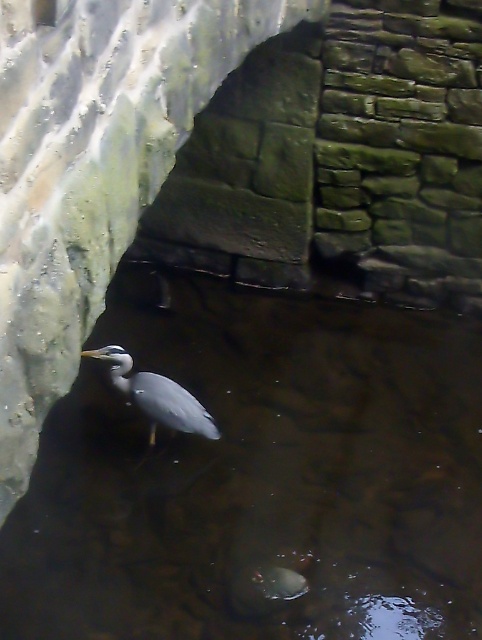
Between clear water at center and gray matte bird at center, which one appears on the right side from the viewer's perspective?

clear water at center is more to the right.

Who is higher up, clear water at center or gray matte bird at center?

Positioned higher is gray matte bird at center.

The width and height of the screenshot is (482, 640). I want to click on clear water at center, so click(257, 476).

The image size is (482, 640). I want to click on clear water at center, so click(x=257, y=476).